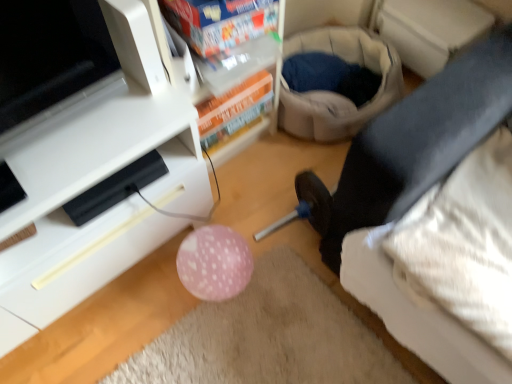
Question: Does point (426, 109) appear closer or farther from the camera than point (154, 84)?

Choices:
 (A) closer
 (B) farther

Answer: (A)

Question: From their relative heights in the image, would you say black fabric leg at lower right is taller or shorter than white glossy tv stand at lower left?

Choices:
 (A) short
 (B) tall

Answer: (A)

Question: Estimate the real-world distances between objects in this image. Which object is farther from the black fabric leg at lower right?

Choices:
 (A) white glossy tv stand at lower left
 (B) white plastic shelf at upper center

Answer: (A)

Question: Considering the real-world distances, which object is closest to the black fabric leg at lower right?

Choices:
 (A) white glossy tv stand at lower left
 (B) white plastic shelf at upper center

Answer: (B)